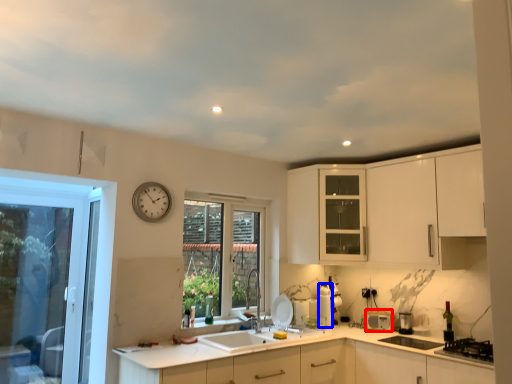
Question: Which object appears closest to the camera in this image, appliance (highlighted by a red box) or appliance (highlighted by a blue box)?

Choices:
 (A) appliance
 (B) appliance

Answer: (A)